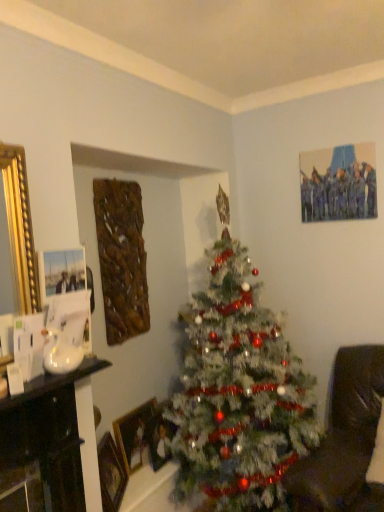
Question: Would you say wooden picture frame at lower left, which is the first picture frame from front to back, is part of wooden picture frame at lower left, marked as the 2th picture frame in a front-to-back arrangement,'s contents?

Choices:
 (A) no
 (B) yes

Answer: (A)

Question: Are wooden picture frame at lower left, marked as the 2th picture frame in a front-to-back arrangement, and wooden picture frame at lower left, the 3th picture frame viewed from the back, beside each other?

Choices:
 (A) no
 (B) yes

Answer: (A)

Question: Is wooden picture frame at lower left, marked as the 2th picture frame in a front-to-back arrangement, located outside wooden picture frame at lower left, the 3th picture frame viewed from the back?

Choices:
 (A) yes
 (B) no

Answer: (A)

Question: From the image's perspective, is wooden picture frame at lower left, marked as the 2th picture frame in a front-to-back arrangement, below wooden picture frame at lower left, which is the first picture frame from front to back?

Choices:
 (A) yes
 (B) no

Answer: (B)

Question: From a real-world perspective, is wooden picture frame at lower left, the second picture frame viewed from the back, beneath wooden picture frame at lower left, which is the first picture frame from front to back?

Choices:
 (A) no
 (B) yes

Answer: (A)

Question: Can you confirm if wooden picture frame at lower left, the second picture frame viewed from the back, is smaller than wooden picture frame at lower left, which is the first picture frame from front to back?

Choices:
 (A) yes
 (B) no

Answer: (A)

Question: Does wooden picture frame at lower left, the 3th picture frame viewed from the back, turn towards wooden picture frame at center, the 3th picture frame positioned from the front?

Choices:
 (A) no
 (B) yes

Answer: (A)

Question: Is wooden picture frame at lower left, which is the first picture frame from front to back, surrounding wooden picture frame at center, which appears as the first picture frame when viewed from the back?

Choices:
 (A) yes
 (B) no

Answer: (B)

Question: From the image's perspective, is wooden picture frame at lower left, which is the first picture frame from front to back, located beneath wooden picture frame at center, the 3th picture frame positioned from the front?

Choices:
 (A) yes
 (B) no

Answer: (A)

Question: From a real-world perspective, does wooden picture frame at lower left, which is the first picture frame from front to back, sit lower than wooden picture frame at center, which appears as the first picture frame when viewed from the back?

Choices:
 (A) no
 (B) yes

Answer: (B)

Question: Can you confirm if wooden picture frame at lower left, the 3th picture frame viewed from the back, is thinner than wooden picture frame at center, the 3th picture frame positioned from the front?

Choices:
 (A) no
 (B) yes

Answer: (A)

Question: Can you confirm if wooden picture frame at lower left, the 3th picture frame viewed from the back, is shorter than wooden picture frame at center, the 3th picture frame positioned from the front?

Choices:
 (A) yes
 (B) no

Answer: (B)

Question: Can you confirm if wooden picture frame at lower left, the second picture frame viewed from the back, is wider than white frosted christmas tree at center?

Choices:
 (A) yes
 (B) no

Answer: (B)